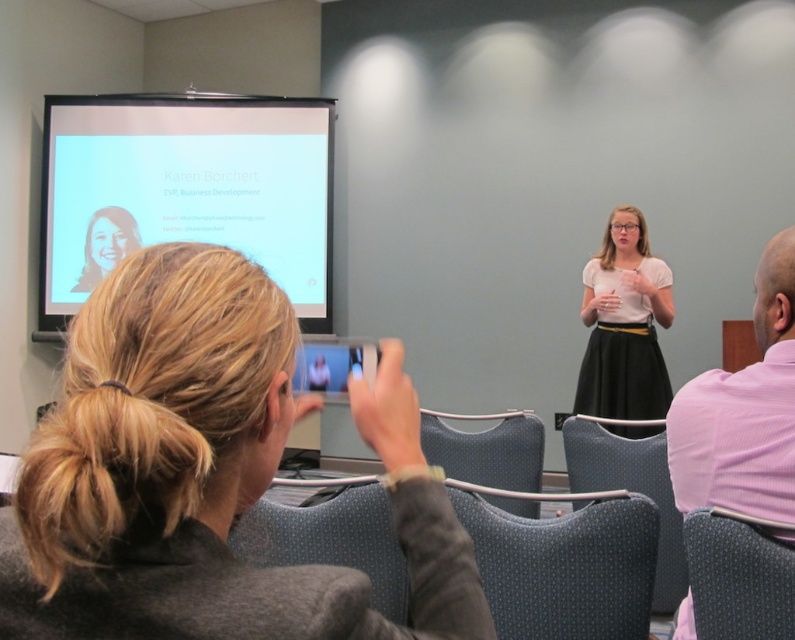
You are an interior designer assessing the conference room layout. You notice the pink textured shirt at right and the dark gray fabric chair at lower right. Which object has a smaller width when viewed from the front?

The pink textured shirt at right has a smaller width when viewed from the front since it is thinner than the dark gray fabric chair at lower right.

Where is the blonde hair at upper left located in the image?

The blonde hair at upper left is located at point coordinates of 0.742 on the x axis and 0.260 on the y axis.